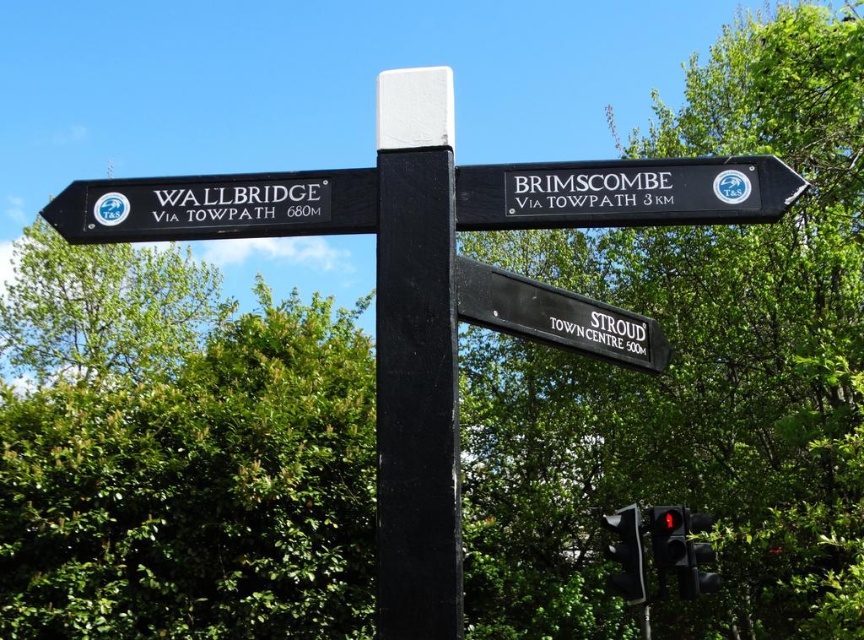
You are standing at the intersection and need to decide whether to walk towards the black plastic sign at left or the red glass traffic light at lower right. Which object is closer to you based on their positions?

The black plastic sign at left is closer to you because it is positioned in front of the red glass traffic light at lower right.

You are standing in front of the signpost and want to read the text on the black plastic sign at left. Can you reach it without any tools?

The black plastic sign at left is 2.82 meters from viewer, so it is too high to reach without a ladder or other tool.